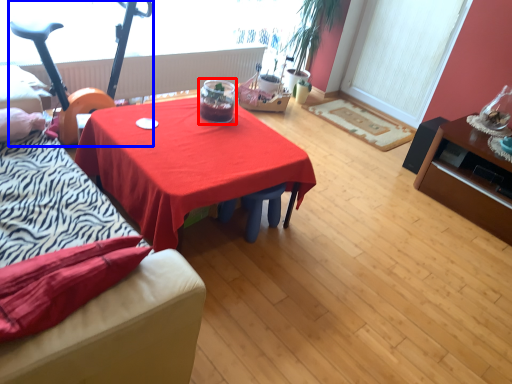
Question: Which point is closer to the camera, glass jar (highlighted by a red box) or baby carriage (highlighted by a blue box)?

Choices:
 (A) glass jar
 (B) baby carriage

Answer: (B)